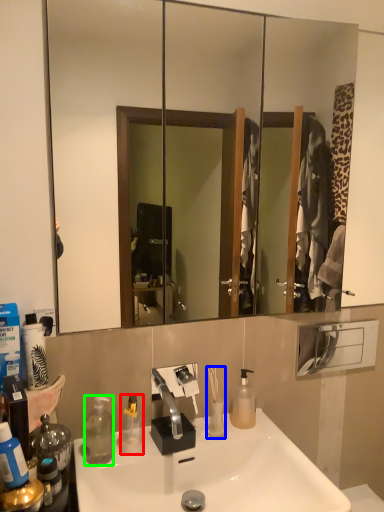
Question: Estimate the real-world distances between objects in this image. Which object is closer to bottle (highlighted by a red box), toiletry (highlighted by a blue box) or bottle (highlighted by a green box)?

Choices:
 (A) toiletry
 (B) bottle

Answer: (B)